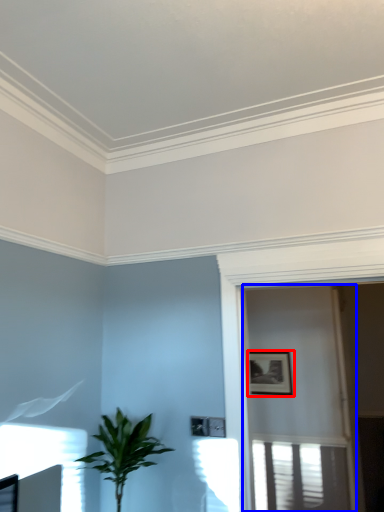
Question: Which object appears closest to the camera in this image, picture frame (highlighted by a red box) or screen door (highlighted by a blue box)?

Choices:
 (A) picture frame
 (B) screen door

Answer: (B)